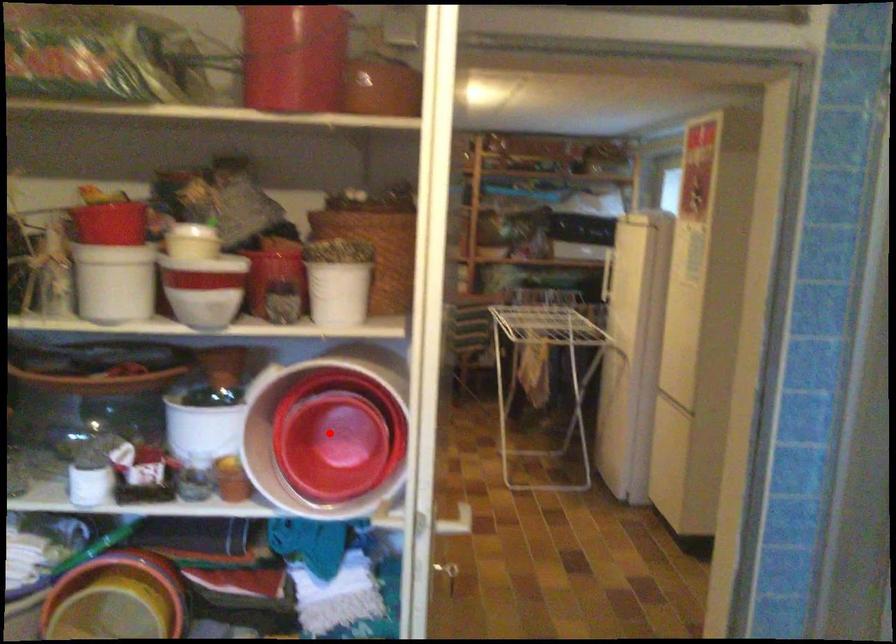
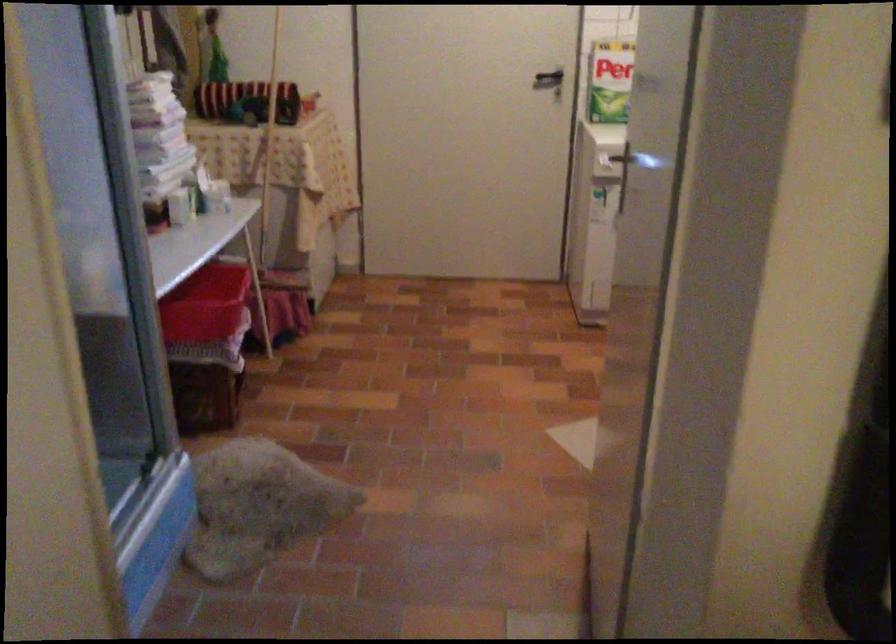
Question: I am providing you with two images of the same scene from different viewpoints. A red point is marked on the first image. At the location where the point appears in image 1, is it still visible in image 2?

Choices:
 (A) Yes
 (B) No

Answer: (B)